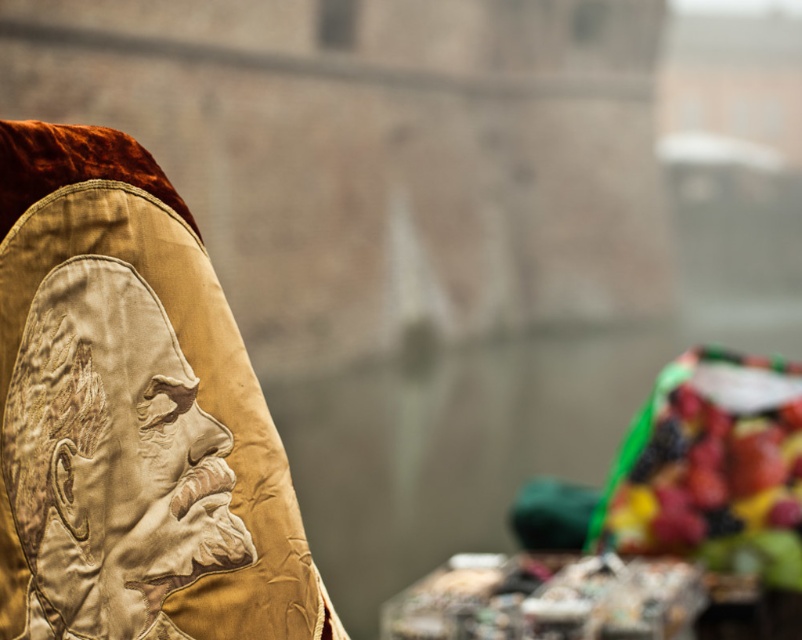
You are an interior designer examining the fabric with the satin gold portrait at left. If you want to place a small decorative pin exactly at the center of the portrait, what are the coordinates where you should position it?

The satin gold portrait at left is located at point (111,460), so you should position the pin at those coordinates to place it exactly at the center of the portrait.

You are a drone operator who needs to fly a drone from the satin gold portrait at left to the shiny plastic fruits at right. The drone has a maximum flight range of 10 meters. Can the drone complete the journey without needing to recharge?

The distance between the satin gold portrait at left and the shiny plastic fruits at right is 8.72 meters, so yes, the drone can complete the journey without needing to recharge since it is within the 10 meter range.